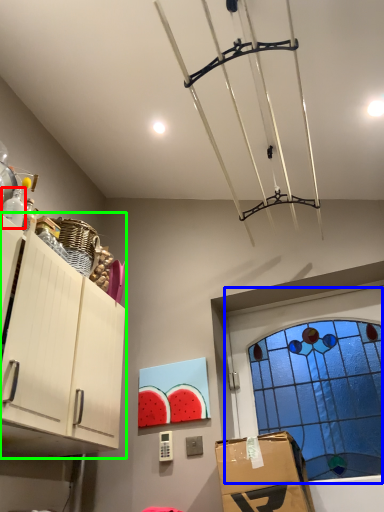
Question: Considering the real-world distances, which object is farthest from bottle (highlighted by a red box)? window (highlighted by a blue box) or cabinetry (highlighted by a green box)?

Choices:
 (A) window
 (B) cabinetry

Answer: (A)